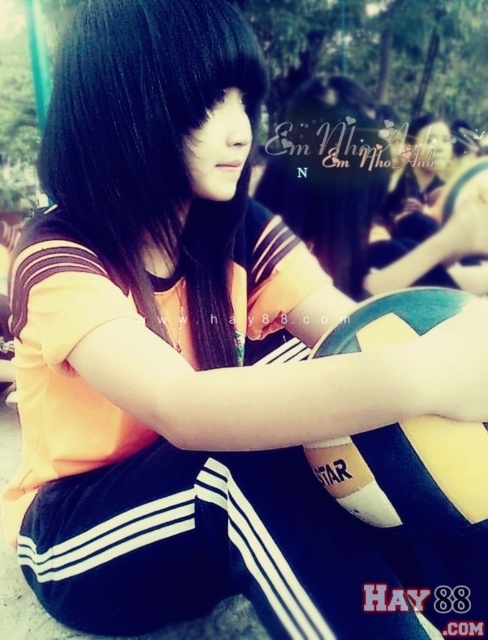
You are a photographer adjusting your camera settings to focus on the black glossy hair at center and the blue rubber beach ball at center. Which object should you adjust your focus to first if you want to ensure both are in focus, considering their heights?

The black glossy hair at center is taller than the blue rubber beach ball at center, so you should focus on the black glossy hair at center first to ensure both are in focus.

You are a photographer adjusting the focus on your camera. The subject is the person with black glossy hair at center, and there is a blue rubber beach ball at center. If you focus on the person, will the beach ball also be in focus? Please explain using the distance between them.

The distance between the black glossy hair at center and the blue rubber beach ball at center is 36.65 centimeters. Since the beach ball is at the same central position as the person, it will likely be in focus if the camera is focused on the person. The shallow depth of field mentioned in the scene might keep both in focus if they are within the same focal plane.